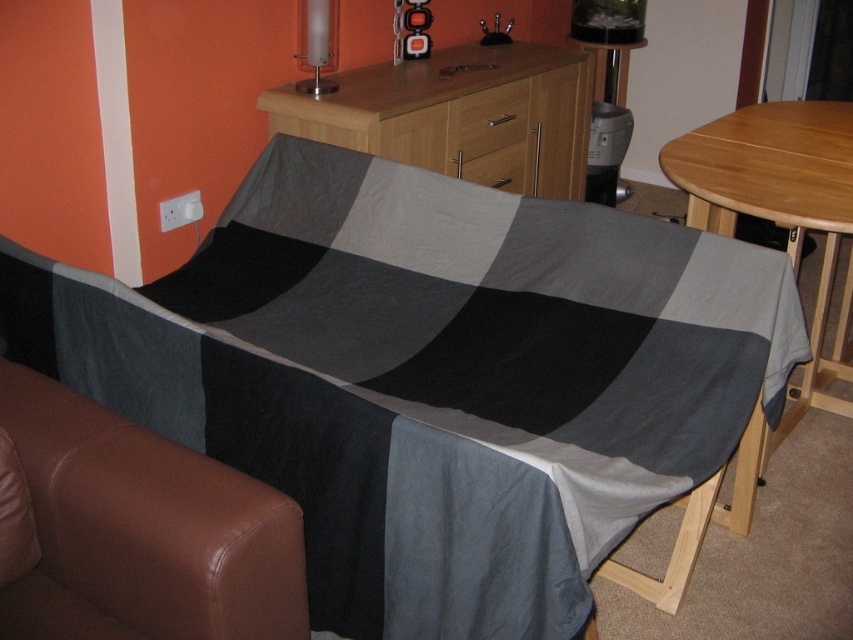
Can you confirm if brown leather armchair at lower left is positioned to the right of matte wood drawer at center?

In fact, brown leather armchair at lower left is to the left of matte wood drawer at center.

Is point (216, 506) positioned in front of point (486, 186)?

Yes, it is in front of point (486, 186).

Where is `brown leather armchair at lower left`? brown leather armchair at lower left is located at coordinates (142, 531).

Can you confirm if textured cotton blanket at center is positioned to the left of beech wood dresser at center?

Yes, textured cotton blanket at center is to the left of beech wood dresser at center.

Who is positioned more to the left, textured cotton blanket at center or beech wood dresser at center?

Positioned to the left is textured cotton blanket at center.

Which is in front, point (512, 390) or point (444, 93)?

Point (512, 390)

I want to click on textured cotton blanket at center, so click(x=450, y=376).

Image resolution: width=853 pixels, height=640 pixels. What are the coordinates of `matte glass lampshade at upper center` in the screenshot? It's located at (317, 44).

Does matte glass lampshade at upper center appear on the left side of matte wood drawer at center?

Yes, matte glass lampshade at upper center is to the left of matte wood drawer at center.

Who is more distant from viewer, (318, 92) or (492, 163)?

Point (492, 163)

Locate an element on the screen. Image resolution: width=853 pixels, height=640 pixels. matte glass lampshade at upper center is located at coordinates (317, 44).